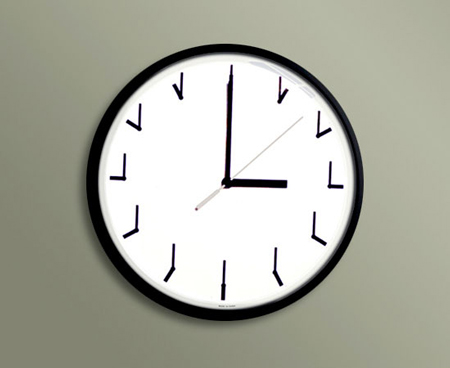
Locate an element on the screen. The width and height of the screenshot is (450, 368). small text on clock is located at coordinates pyautogui.click(x=226, y=306).